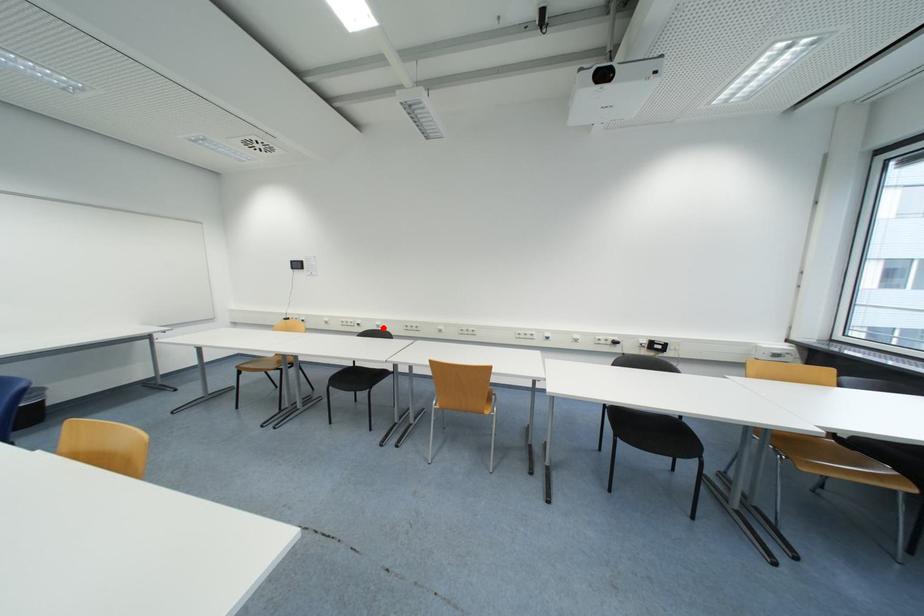
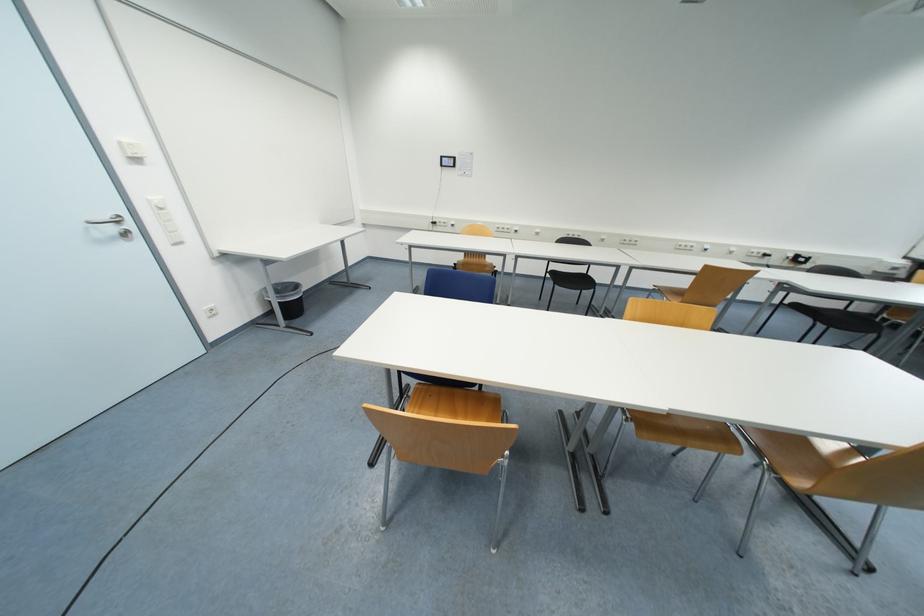
Question: A red point is marked in image1. In image2, is the corresponding 3D point closer to the camera or farther? Reply with the corresponding letter.

Choices:
 (A) The corresponding 3D point is closer.
 (B) The corresponding 3D point is farther.

Answer: (A)